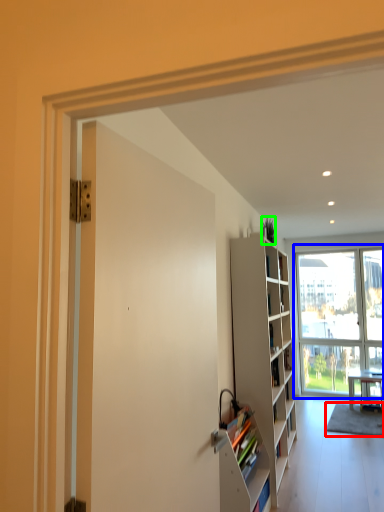
Question: Based on their relative distances, which object is nearer to carpets (highlighted by a red box)? Choose from window (highlighted by a blue box) and houseplant (highlighted by a green box).

Choices:
 (A) window
 (B) houseplant

Answer: (A)